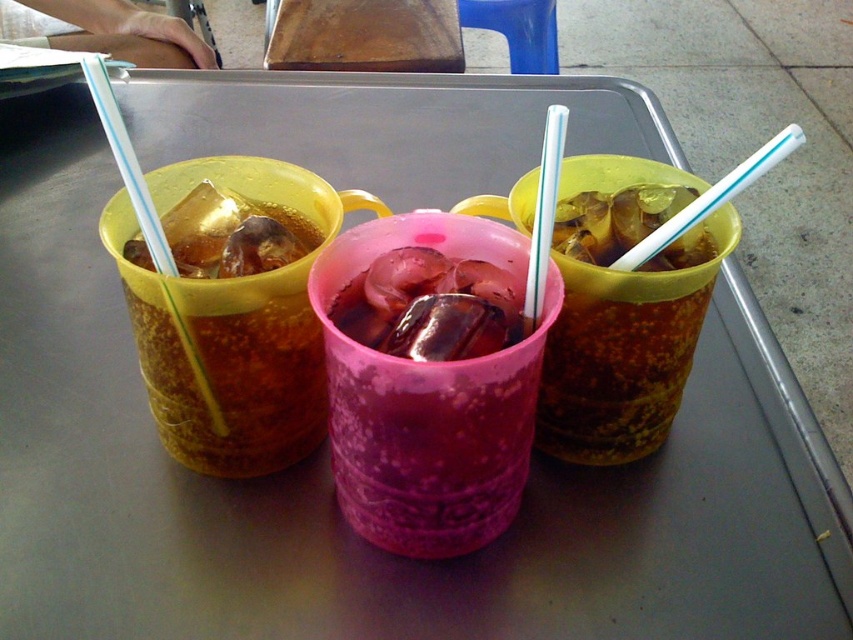
Who is more distant from viewer, [631,276] or [566,113]?

Point [631,276]

Where is `translucent yellow cup at right`? translucent yellow cup at right is located at coordinates (614, 369).

Can you confirm if translucent yellow cup at center is positioned to the left of translucent plastic straw at right?

Correct, you'll find translucent yellow cup at center to the left of translucent plastic straw at right.

Can you confirm if translucent yellow cup at center is bigger than translucent plastic straw at right?

No.

Is point (602, 208) closer to camera compared to point (628, 260)?

No.

Where is `translucent yellow cup at center`? This screenshot has width=853, height=640. translucent yellow cup at center is located at coordinates (614, 220).

Is translucent yellow cup at left to the left of translucent yellow cup at right from the viewer's perspective?

Yes, translucent yellow cup at left is to the left of translucent yellow cup at right.

Is point (287, 384) positioned behind point (567, 346)?

That is False.

Find the location of `translucent yellow cup at left`. translucent yellow cup at left is located at coordinates (225, 380).